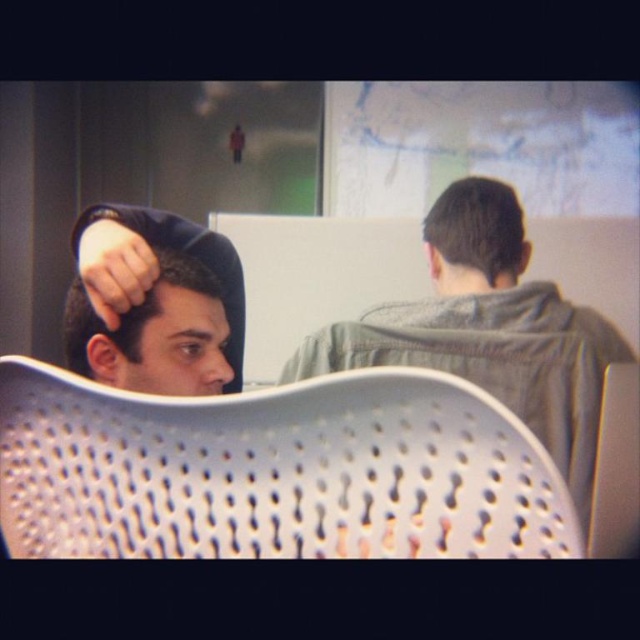
Measure the distance between gray fabric jacket at upper right and matte black hair at left.

gray fabric jacket at upper right is 16.35 inches from matte black hair at left.

Is gray fabric jacket at upper right smaller than matte black hair at left?

No, gray fabric jacket at upper right is not smaller than matte black hair at left.

Who is more forward, (484,339) or (90,369)?

Positioned in front is point (90,369).

The width and height of the screenshot is (640, 640). What are the coordinates of `gray fabric jacket at upper right` in the screenshot? It's located at (490, 330).

In the scene shown: Is white perforated chair at center thinner than gray fabric jacket at upper right?

Yes.

Locate an element on the screen. white perforated chair at center is located at coordinates (275, 472).

Between white perforated chair at center and matte black hair at left, which one has less height?

Standing shorter between the two is white perforated chair at center.

Which is above, white perforated chair at center or matte black hair at left?

matte black hair at left is above.

The width and height of the screenshot is (640, 640). Find the location of `white perforated chair at center`. white perforated chair at center is located at coordinates (275, 472).